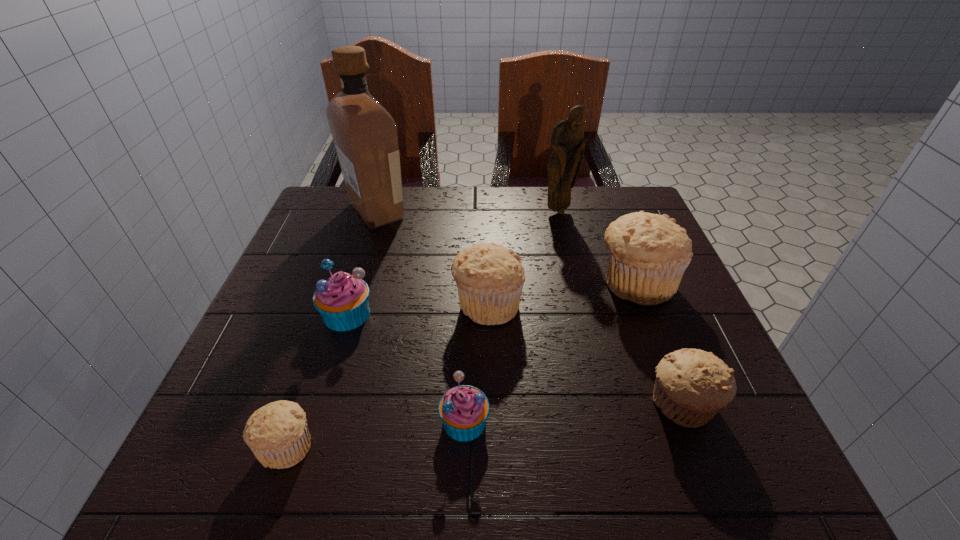
This screenshot has width=960, height=540. I want to click on the second smallest beige muffin, so click(692, 385).

Locate an element on the screen. The height and width of the screenshot is (540, 960). the nearer blue muffin is located at coordinates (464, 409).

This screenshot has height=540, width=960. Identify the location of the right blue muffin. (464, 409).

The width and height of the screenshot is (960, 540). Find the location of `the smallest beige muffin`. the smallest beige muffin is located at coordinates 277,433.

I want to click on vacant space located 0.290m on the front-facing side of the tallest object, so click(517, 211).

Locate an element on the screen. Image resolution: width=960 pixels, height=540 pixels. vacant region located 0.350m on the front-facing side of the second tallest object is located at coordinates (582, 311).

Image resolution: width=960 pixels, height=540 pixels. I want to click on blank space located on the left of the tallest muffin, so click(x=417, y=283).

Locate an element on the screen. The image size is (960, 540). vacant area situated on the right of the third beige muffin from right to left is located at coordinates (x=584, y=304).

The image size is (960, 540). I want to click on vacant space located 0.150m on the back of the bigger blue muffin, so click(x=366, y=252).

Image resolution: width=960 pixels, height=540 pixels. Find the location of `free space located 0.150m on the left of the second smallest beige muffin`. free space located 0.150m on the left of the second smallest beige muffin is located at coordinates (558, 405).